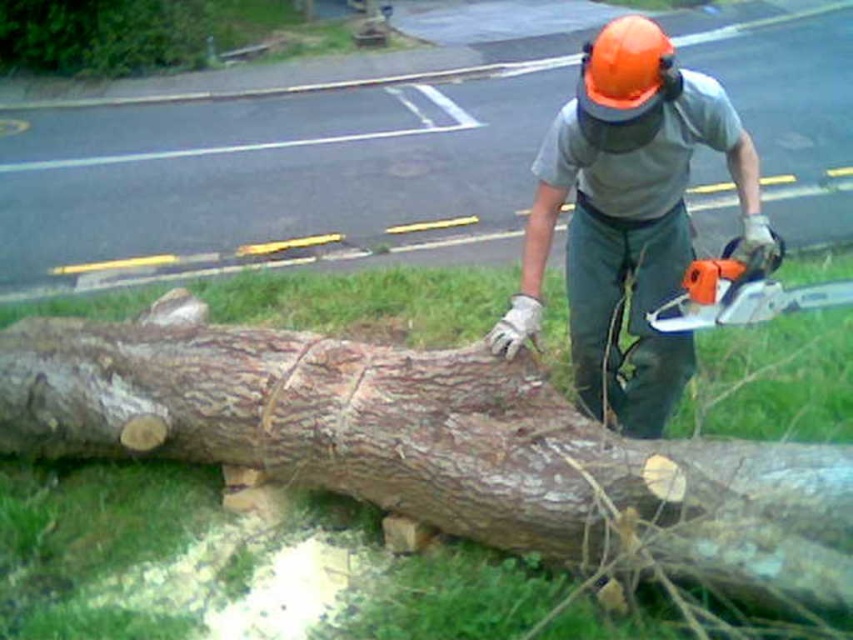
Question: Which of the following is the closest to the observer?

Choices:
 (A) brown rough wood at center
 (B) orange plastic chainsaw at center
 (C) orange hard hat at upper center

Answer: (A)

Question: Which point appears farthest from the camera in this image?

Choices:
 (A) (756, 236)
 (B) (689, 324)
 (C) (239, 376)

Answer: (C)

Question: Can you confirm if orange hard hat at upper center is smaller than orange plastic chainsaw at center?

Choices:
 (A) no
 (B) yes

Answer: (A)

Question: Estimate the real-world distances between objects in this image. Which object is farther from the brown rough wood at center?

Choices:
 (A) orange plastic chainsaw at center
 (B) orange hard hat at upper center

Answer: (A)

Question: Observing the image, what is the correct spatial positioning of orange hard hat at upper center in reference to orange plastic chainsaw at center?

Choices:
 (A) left
 (B) right

Answer: (A)

Question: Does orange hard hat at upper center appear over orange plastic chainsaw at center?

Choices:
 (A) yes
 (B) no

Answer: (A)